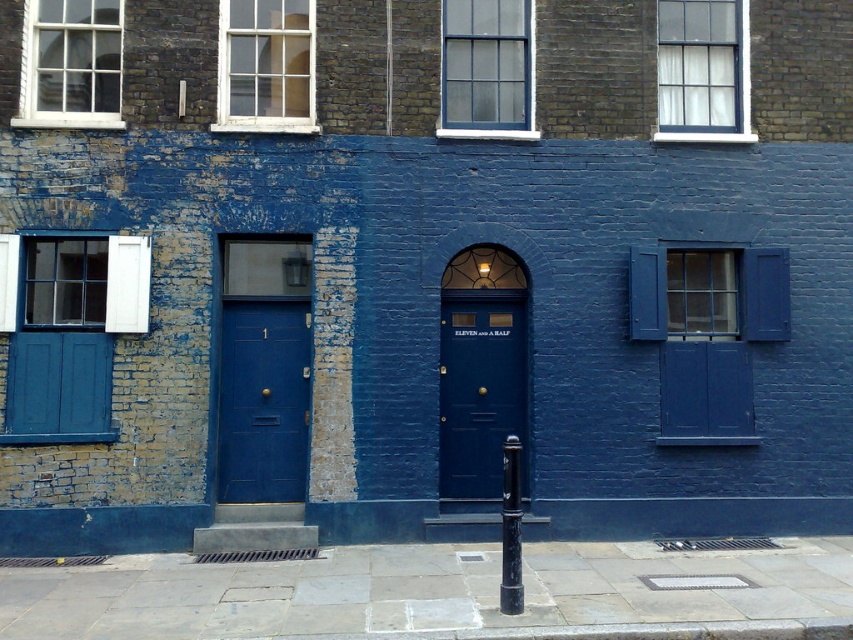
Can you confirm if matte blue door at left is thinner than white glass window at upper right?

Indeed, matte blue door at left has a lesser width compared to white glass window at upper right.

Does matte blue door at left have a greater height compared to white glass window at upper right?

Yes, matte blue door at left is taller than white glass window at upper right.

Who is more forward, [248,397] or [709,49]?

Point [248,397] is in front.

Identify the location of matte blue door at left. The image size is (853, 640). point(263,397).

Between matte blue door at left and white wooden window at upper center, which one appears on the left side from the viewer's perspective?

matte blue door at left is more to the left.

Is point (227, 326) positioned before point (221, 17)?

No, (227, 326) is behind (221, 17).

Which is in front, point (260, 442) or point (253, 129)?

Point (253, 129) is in front.

At what (x,y) coordinates should I click in order to perform the action: click on matte blue door at left. Please return your answer as a coordinate pair (x, y). Looking at the image, I should click on (263, 397).

Can you confirm if matte blue door at left is taller than matte glass window at center?

Yes.

Who is more forward, (276, 490) or (531, 84)?

Point (276, 490)

Does point (263, 328) come in front of point (490, 17)?

Yes.

This screenshot has width=853, height=640. Identify the location of matte blue door at left. (263, 397).